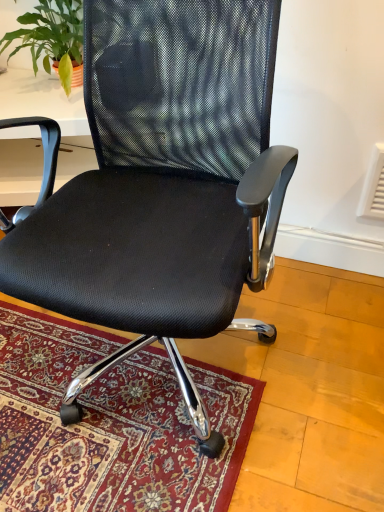
Question: From the image's perspective, is green leafy plant at upper left over black mesh office chair at center?

Choices:
 (A) no
 (B) yes

Answer: (B)

Question: Is green leafy plant at upper left outside of black mesh office chair at center?

Choices:
 (A) no
 (B) yes

Answer: (B)

Question: Considering the relative sizes of green leafy plant at upper left and black mesh office chair at center in the image provided, is green leafy plant at upper left wider than black mesh office chair at center?

Choices:
 (A) no
 (B) yes

Answer: (A)

Question: From a real-world perspective, is green leafy plant at upper left on top of black mesh office chair at center?

Choices:
 (A) yes
 (B) no

Answer: (A)

Question: Is green leafy plant at upper left in front of black mesh office chair at center?

Choices:
 (A) no
 (B) yes

Answer: (A)

Question: From a real-world perspective, is green leafy plant at upper left beneath black mesh office chair at center?

Choices:
 (A) no
 (B) yes

Answer: (A)

Question: Is black mesh office chair at center wider than green leafy plant at upper left?

Choices:
 (A) yes
 (B) no

Answer: (A)

Question: Is the surface of black mesh office chair at center in direct contact with green leafy plant at upper left?

Choices:
 (A) no
 (B) yes

Answer: (A)

Question: Does black mesh office chair at center appear on the right side of green leafy plant at upper left?

Choices:
 (A) no
 (B) yes

Answer: (B)

Question: Is black mesh office chair at center positioned far away from green leafy plant at upper left?

Choices:
 (A) yes
 (B) no

Answer: (B)

Question: From the image's perspective, is black mesh office chair at center beneath green leafy plant at upper left?

Choices:
 (A) no
 (B) yes

Answer: (B)

Question: Can we say black mesh office chair at center lies outside green leafy plant at upper left?

Choices:
 (A) yes
 (B) no

Answer: (A)

Question: Is point (56, 15) closer or farther from the camera than point (157, 205)?

Choices:
 (A) closer
 (B) farther

Answer: (B)